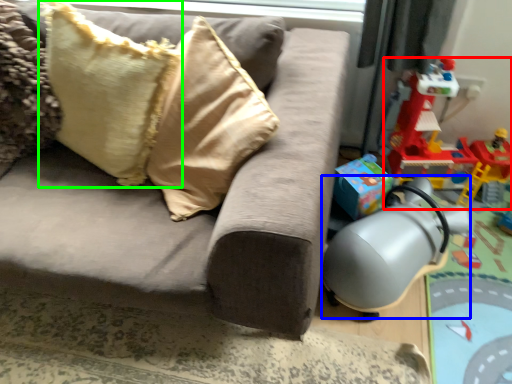
Question: Considering the real-world distances, which object is closest to toy (highlighted by a red box)? swivel chair (highlighted by a blue box) or pillow (highlighted by a green box).

Choices:
 (A) swivel chair
 (B) pillow

Answer: (A)